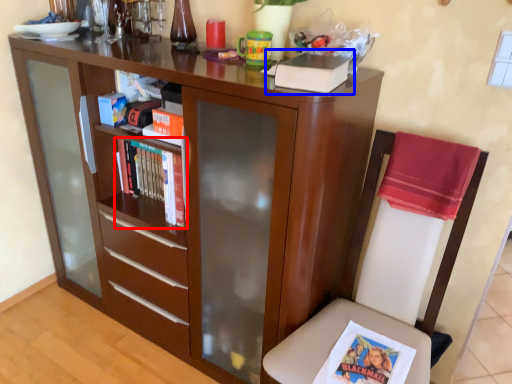
Question: Which object is closer to the camera taking this photo, book (highlighted by a red box) or paperback book (highlighted by a blue box)?

Choices:
 (A) book
 (B) paperback book

Answer: (B)